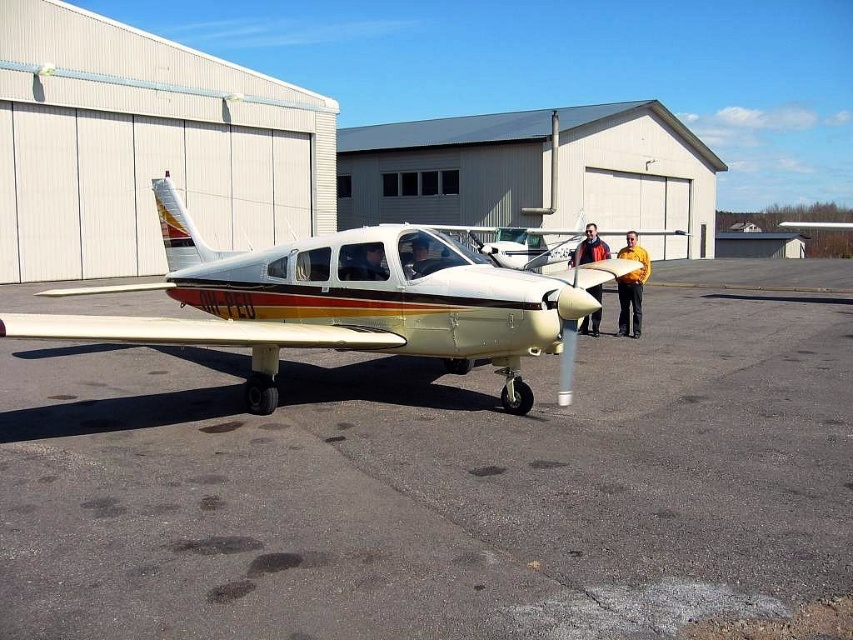
Is the position of orange fabric jacket at center less distant than that of matte black helmet at center?

Yes, orange fabric jacket at center is closer to the viewer.

Who is more distant from viewer, (595, 243) or (366, 275)?

Positioned behind is point (595, 243).

The image size is (853, 640). In order to click on orange fabric jacket at center in this screenshot , I will do `click(589, 248)`.

You are a GUI agent. You are given a task and a screenshot of the screen. Output one action in this format:
    pyautogui.click(x=<x>, y=<y>)
    Task: Click on the orange fabric jacket at center
    
    Given the screenshot: What is the action you would take?
    pyautogui.click(x=589, y=248)

Between smooth asphalt tarmac at center and matte black helmet at center, which one has less height?

With less height is matte black helmet at center.

Does point (94, 579) come farther from viewer compared to point (363, 244)?

No, it is in front of (363, 244).

Does point (724, 609) come closer to viewer compared to point (358, 243)?

That is True.

You are a GUI agent. You are given a task and a screenshot of the screen. Output one action in this format:
    pyautogui.click(x=<x>, y=<y>)
    Task: Click on the smooth asphalt tarmac at center
    
    Given the screenshot: What is the action you would take?
    pyautogui.click(x=440, y=481)

Is metallic gold airplane at center bigger than yellow shirt at center?

Correct, metallic gold airplane at center is larger in size than yellow shirt at center.

Is the position of metallic gold airplane at center less distant than that of yellow shirt at center?

That is True.

Does point (183, 328) come in front of point (635, 337)?

Yes, point (183, 328) is in front of point (635, 337).

I want to click on metallic gold airplane at center, so click(347, 304).